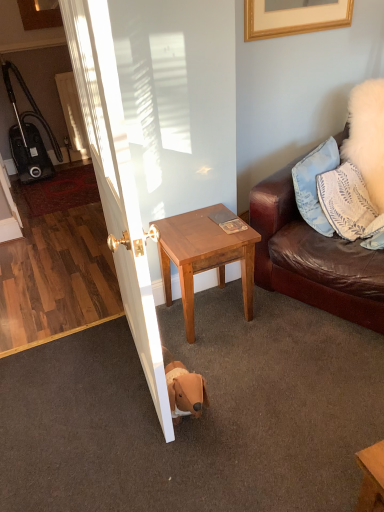
Image resolution: width=384 pixels, height=512 pixels. I want to click on free location to the right of light brown wood side table at center, so click(x=288, y=324).